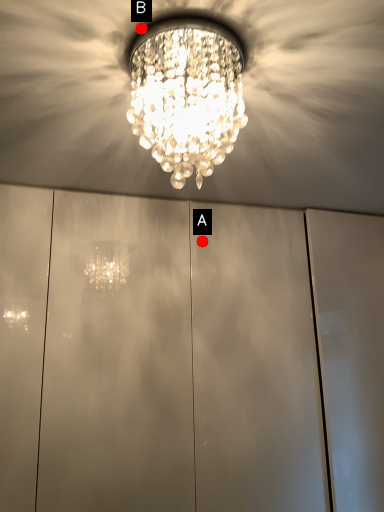
Question: Two points are circled on the image, labeled by A and B beside each circle. Which point is further to the camera?

Choices:
 (A) A is further
 (B) B is further

Answer: (A)